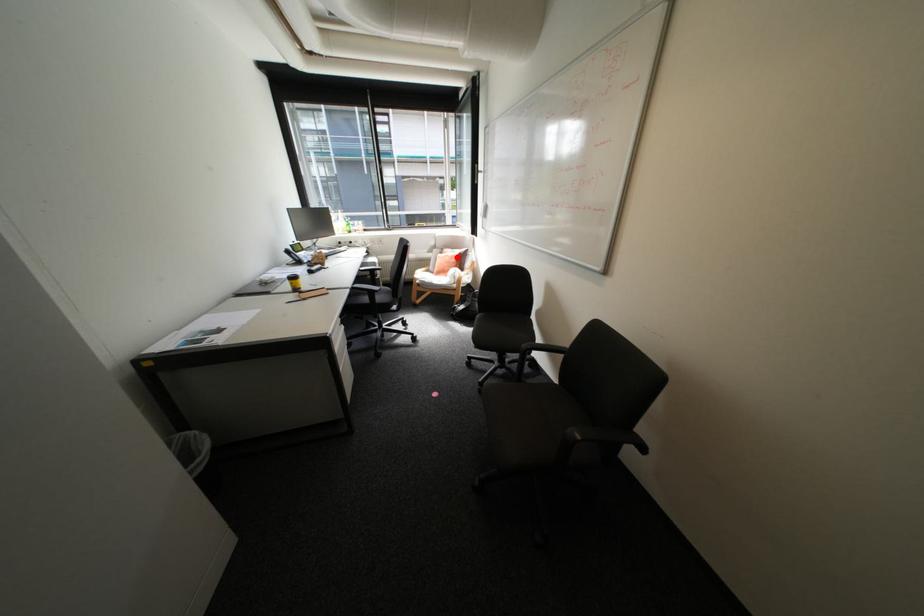
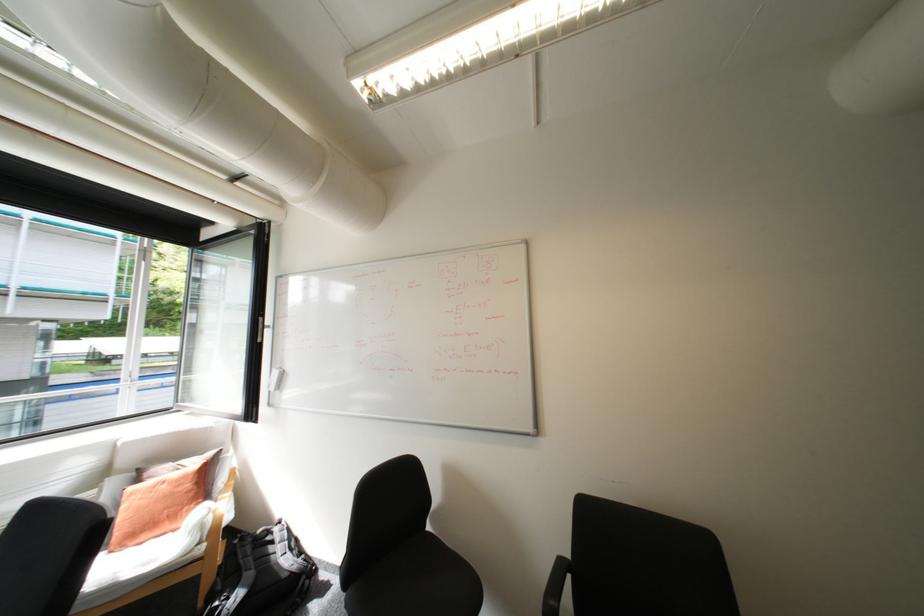
Where in the second image is the point corresponding to the highlighted location from the first image?

(175, 485)